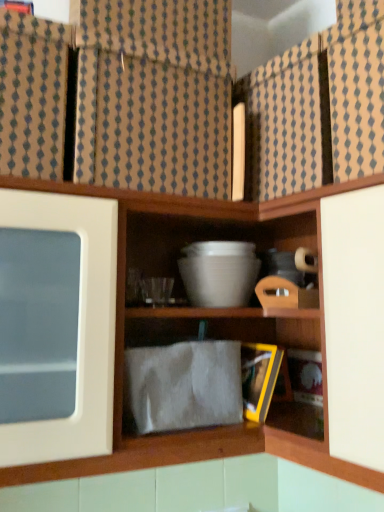
Question: From the image's perspective, does white glossy mixing bowl at center appear lower than brown textured fabric at upper center?

Choices:
 (A) yes
 (B) no

Answer: (A)

Question: Does white glossy mixing bowl at center appear on the left side of brown textured fabric at upper center?

Choices:
 (A) no
 (B) yes

Answer: (A)

Question: Is white glossy mixing bowl at center positioned far away from brown textured fabric at upper center?

Choices:
 (A) yes
 (B) no

Answer: (B)

Question: Is brown textured fabric at upper center a part of white glossy mixing bowl at center?

Choices:
 (A) no
 (B) yes

Answer: (A)

Question: From the image's perspective, would you say white glossy mixing bowl at center is positioned over brown textured fabric at upper center?

Choices:
 (A) no
 (B) yes

Answer: (A)

Question: Are white glossy mixing bowl at center and brown textured fabric at upper center beside each other?

Choices:
 (A) no
 (B) yes

Answer: (A)

Question: From the image's perspective, does brown textured fabric at upper center appear higher than white glossy mixing bowl at center?

Choices:
 (A) no
 (B) yes

Answer: (B)

Question: Considering the relative sizes of brown textured fabric at upper center and white glossy mixing bowl at center in the image provided, is brown textured fabric at upper center taller than white glossy mixing bowl at center?

Choices:
 (A) no
 (B) yes

Answer: (B)

Question: Can you confirm if brown textured fabric at upper center is smaller than white glossy mixing bowl at center?

Choices:
 (A) no
 (B) yes

Answer: (A)

Question: Is brown textured fabric at upper center not inside white glossy mixing bowl at center?

Choices:
 (A) yes
 (B) no

Answer: (A)

Question: Considering the relative positions of brown textured fabric at upper center and white glossy mixing bowl at center in the image provided, is brown textured fabric at upper center to the right of white glossy mixing bowl at center from the viewer's perspective?

Choices:
 (A) yes
 (B) no

Answer: (B)

Question: Does brown textured fabric at upper center come in front of white glossy mixing bowl at center?

Choices:
 (A) no
 (B) yes

Answer: (B)

Question: Is the depth of brown textured fabric at upper center less than that of white matte bowl at upper center?

Choices:
 (A) no
 (B) yes

Answer: (B)